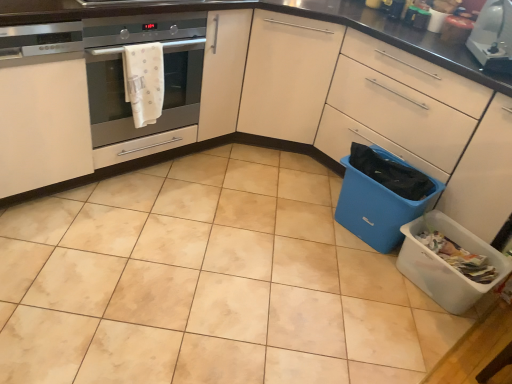
Question: Is white glossy toaster at upper right shorter than satin silver oven at left?

Choices:
 (A) no
 (B) yes

Answer: (B)

Question: Is white glossy toaster at upper right oriented towards satin silver oven at left?

Choices:
 (A) no
 (B) yes

Answer: (B)

Question: Can we say white glossy toaster at upper right lies outside satin silver oven at left?

Choices:
 (A) no
 (B) yes

Answer: (B)

Question: Does white glossy toaster at upper right have a smaller size compared to satin silver oven at left?

Choices:
 (A) no
 (B) yes

Answer: (B)

Question: Is white glossy toaster at upper right bigger than satin silver oven at left?

Choices:
 (A) yes
 (B) no

Answer: (B)

Question: Based on their positions, is blue plastic bin at lower right, which is the 2th material in top-to-bottom order, located to the left or right of blue plastic recycling bin at lower right, the first recycling bin positioned from the top?

Choices:
 (A) left
 (B) right

Answer: (B)

Question: From the image's perspective, is blue plastic bin at lower right, which is the 2th material in top-to-bottom order, located above or below blue plastic recycling bin at lower right, the first recycling bin positioned from the top?

Choices:
 (A) above
 (B) below

Answer: (A)

Question: In terms of width, does blue plastic bin at lower right, which is the 2th material in top-to-bottom order, look wider or thinner when compared to blue plastic recycling bin at lower right, the first recycling bin positioned from the top?

Choices:
 (A) thin
 (B) wide

Answer: (A)

Question: Is point (x=424, y=180) positioned closer to the camera than point (x=369, y=210)?

Choices:
 (A) closer
 (B) farther

Answer: (A)

Question: Is white plastic recycling bin at lower right, which is the 1th recycling bin in bottom-to-top order, wider or thinner than white matte cabinet at left, acting as the first cabinetry starting from the left?

Choices:
 (A) wide
 (B) thin

Answer: (B)

Question: Is white plastic recycling bin at lower right, which is the 1th recycling bin in bottom-to-top order, bigger or smaller than white matte cabinet at left, acting as the first cabinetry starting from the left?

Choices:
 (A) small
 (B) big

Answer: (A)

Question: Is point (434, 281) closer or farther from the camera than point (10, 173)?

Choices:
 (A) closer
 (B) farther

Answer: (B)

Question: From the image's perspective, relative to white matte cabinet at left, acting as the first cabinetry starting from the left, is white plastic recycling bin at lower right, positioned as the 2th recycling bin in top-to-bottom order, above or below?

Choices:
 (A) below
 (B) above

Answer: (A)

Question: Based on their positions, is white matte cabinet at left, acting as the first cabinetry starting from the left, located to the left or right of white fabric towel at left, which is the second material in bottom-to-top order?

Choices:
 (A) left
 (B) right

Answer: (A)

Question: Do you think white matte cabinet at left, marked as the second cabinetry in a right-to-left arrangement, is within white fabric towel at left, which appears as the first material when viewed from the left, or outside of it?

Choices:
 (A) inside
 (B) outside

Answer: (B)